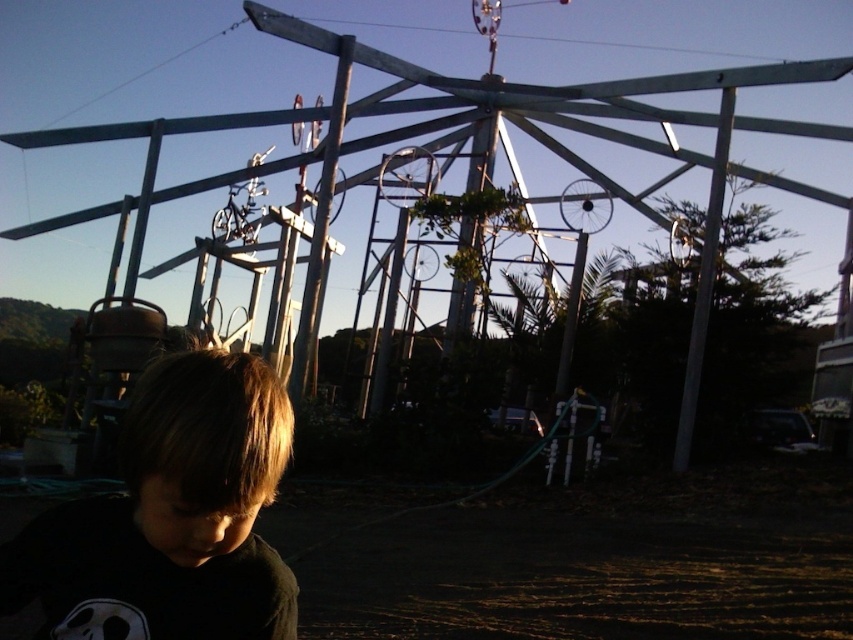
Which is above, metallic silver pole at center or white matte pole at right?

metallic silver pole at center is higher up.

Does metallic silver pole at center appear over white matte pole at right?

Indeed, metallic silver pole at center is positioned over white matte pole at right.

Locate an element on the screen. The image size is (853, 640). metallic silver pole at center is located at coordinates (320, 227).

Between point (189, 492) and point (351, 44), which one is positioned behind?

The point (351, 44) is more distant.

Does dark brown hair at lower left appear under metallic silver pole at center?

Indeed, dark brown hair at lower left is positioned under metallic silver pole at center.

What are the coordinates of `dark brown hair at lower left` in the screenshot? It's located at (171, 516).

Which is below, dark brown hair at lower left or white matte pole at right?

dark brown hair at lower left is lower down.

Which of these two, dark brown hair at lower left or white matte pole at right, stands shorter?

dark brown hair at lower left

Identify the location of dark brown hair at lower left. The image size is (853, 640). (171, 516).